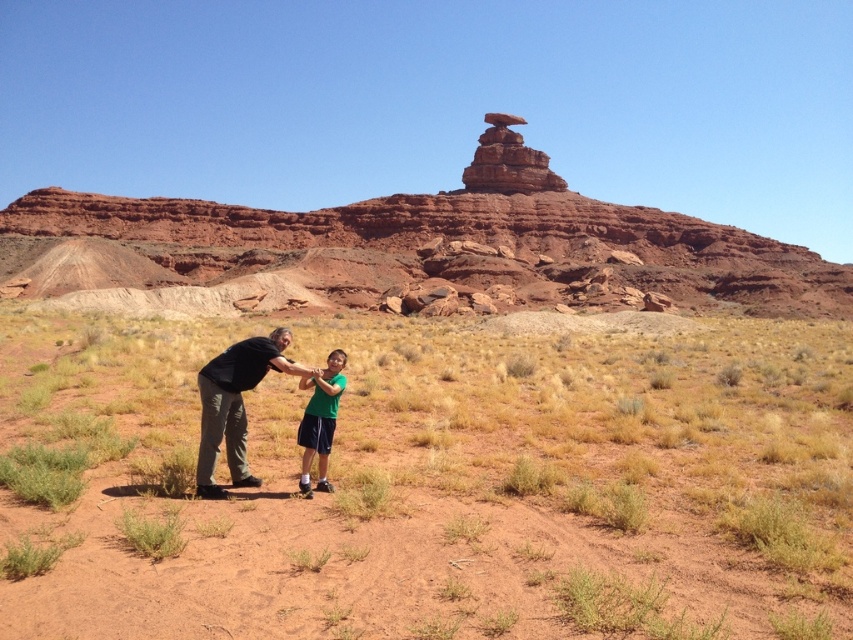
Between brown dirt at center and green matte shirt at center, which one is positioned higher?

brown dirt at center

Does brown dirt at center have a greater height compared to green matte shirt at center?

Correct, brown dirt at center is much taller as green matte shirt at center.

Who is more forward, (709, 508) or (311, 448)?

Point (709, 508) is more forward.

Find the location of a particular element. The height and width of the screenshot is (640, 853). brown dirt at center is located at coordinates (433, 484).

Based on the photo, does dark gray pants at center have a lesser height compared to green matte shirt at center?

Incorrect, dark gray pants at center's height does not fall short of green matte shirt at center's.

Is dark gray pants at center in front of green matte shirt at center?

Yes, it is.

Identify the location of dark gray pants at center. The width and height of the screenshot is (853, 640). (235, 404).

I want to click on dark gray pants at center, so click(235, 404).

Measure the distance between brown dirt at center and dark gray pants at center.

A distance of 12.70 meters exists between brown dirt at center and dark gray pants at center.

Between brown dirt at center and dark gray pants at center, which one appears on the left side from the viewer's perspective?

dark gray pants at center is more to the left.

Describe the element at coordinates (433, 484) in the screenshot. Image resolution: width=853 pixels, height=640 pixels. I see `brown dirt at center` at that location.

At what (x,y) coordinates should I click in order to perform the action: click on brown dirt at center. Please return your answer as a coordinate pair (x, y). Image resolution: width=853 pixels, height=640 pixels. Looking at the image, I should click on (433, 484).